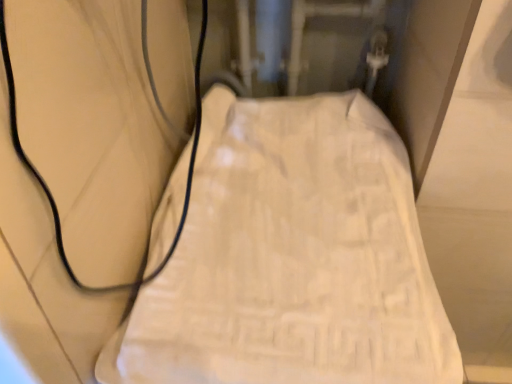
Question: Is black rubber wire at left to the right of white textured towel at center from the viewer's perspective?

Choices:
 (A) no
 (B) yes

Answer: (A)

Question: From a real-world perspective, does black rubber wire at left sit lower than white textured towel at center?

Choices:
 (A) no
 (B) yes

Answer: (A)

Question: Is black rubber wire at left facing away from white textured towel at center?

Choices:
 (A) no
 (B) yes

Answer: (A)

Question: Is there a large distance between black rubber wire at left and white textured towel at center?

Choices:
 (A) yes
 (B) no

Answer: (B)

Question: Is black rubber wire at left directly adjacent to white textured towel at center?

Choices:
 (A) yes
 (B) no

Answer: (B)

Question: Considering the relative sizes of black rubber wire at left and white textured towel at center in the image provided, is black rubber wire at left shorter than white textured towel at center?

Choices:
 (A) yes
 (B) no

Answer: (A)

Question: Can you confirm if white textured towel at center is positioned to the right of black rubber wire at left?

Choices:
 (A) yes
 (B) no

Answer: (A)

Question: Is white textured towel at center positioned before black rubber wire at left?

Choices:
 (A) no
 (B) yes

Answer: (A)

Question: Can you confirm if white textured towel at center is taller than black rubber wire at left?

Choices:
 (A) no
 (B) yes

Answer: (B)

Question: Considering the relative positions of white textured towel at center and black rubber wire at left in the image provided, is white textured towel at center behind black rubber wire at left?

Choices:
 (A) yes
 (B) no

Answer: (A)

Question: From the image's perspective, is white textured towel at center below black rubber wire at left?

Choices:
 (A) no
 (B) yes

Answer: (B)

Question: Is white textured towel at center positioned with its back to black rubber wire at left?

Choices:
 (A) yes
 (B) no

Answer: (B)

Question: Looking at the image, does white textured towel at center seem bigger or smaller compared to black rubber wire at left?

Choices:
 (A) big
 (B) small

Answer: (A)